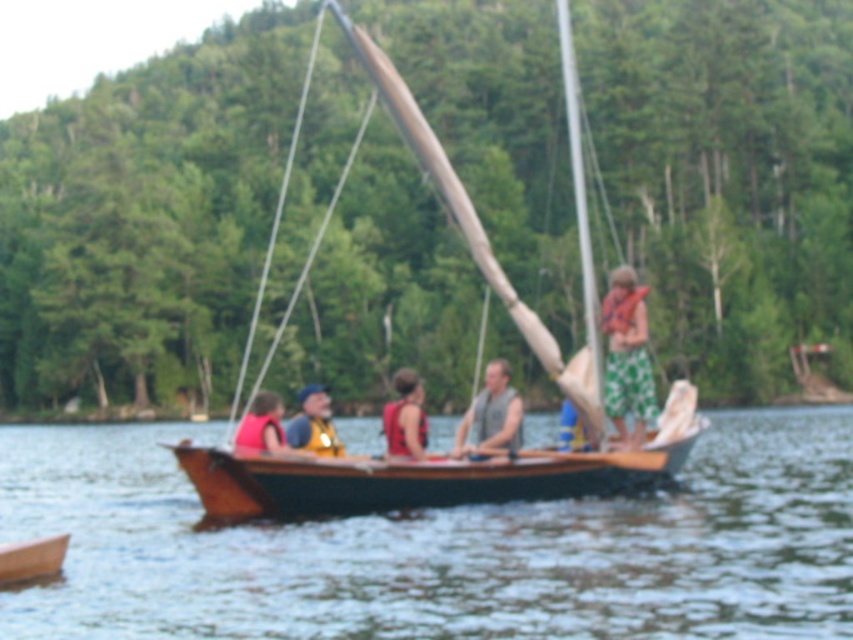
Question: Among these objects, which one is nearest to the camera?

Choices:
 (A) wooden sailboat at center
 (B) wooden life vest at center
 (C) wooden canoe at lower left

Answer: (C)

Question: Based on their relative distances, which object is farther from the wooden life vest at center?

Choices:
 (A) wooden canoe at lower left
 (B) matte red life vest at center

Answer: (A)

Question: In this image, where is green floral shorts at right located relative to gray sleeveless shirt at center?

Choices:
 (A) right
 (B) left

Answer: (A)

Question: Considering the real-world distances, which object is farthest from the wooden life vest at center?

Choices:
 (A) matte red life vest at lower left
 (B) wooden canoe at lower left
 (C) green floral shorts at right

Answer: (A)

Question: Is wooden sailboat at center below blue fabric life vest at center?

Choices:
 (A) no
 (B) yes

Answer: (A)

Question: Can you confirm if wooden sailboat at center is bigger than wooden canoe at lower left?

Choices:
 (A) no
 (B) yes

Answer: (B)